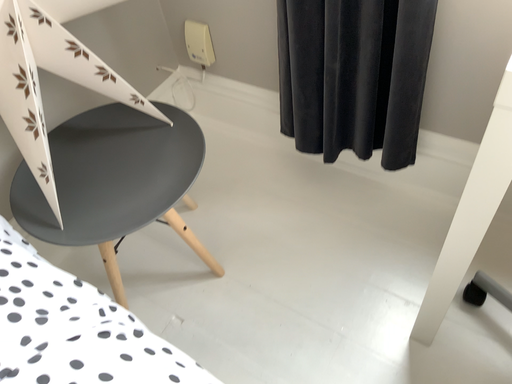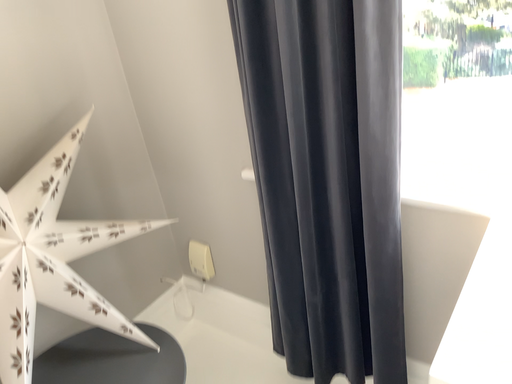
Question: Which way did the camera rotate in the video?

Choices:
 (A) rotated downward
 (B) rotated upward

Answer: (B)